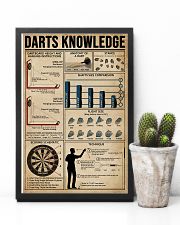
Locate an element on the screen. This screenshot has height=225, width=180. dart board illustation is located at coordinates (41, 164).